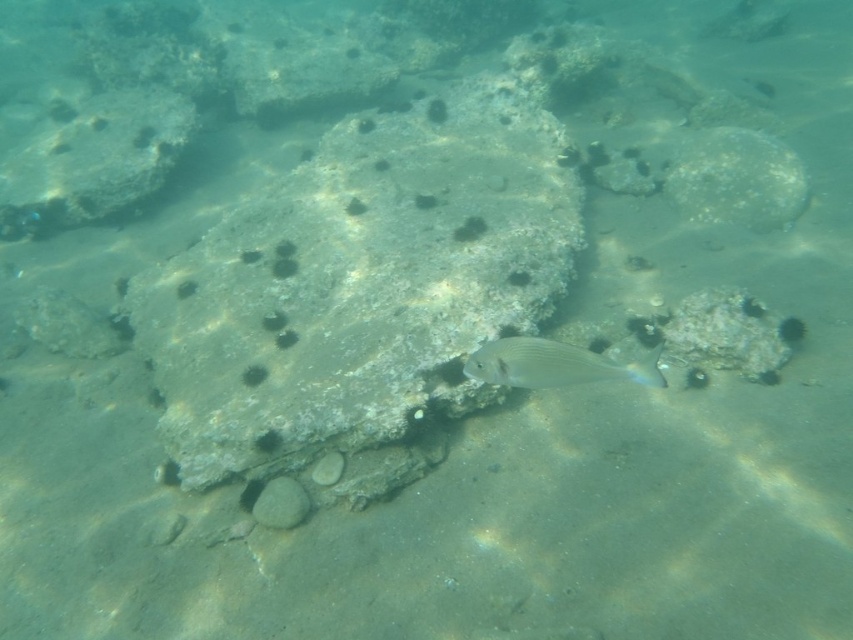
You are a scuba diver swimming underwater and see the gray rock at center and the smooth gray rock at upper right. Which rock is positioned lower in the water?

The gray rock at center is positioned lower in the water than the smooth gray rock at upper right.

You are a scuba diver swimming in the underwater scene and want to reach the smooth gray rock at upper right. Can you estimate how far you need to swim to reach it?

The smooth gray rock at upper right is 13.09 feet away from the viewer, so you need to swim approximately 13.09 feet to reach it.